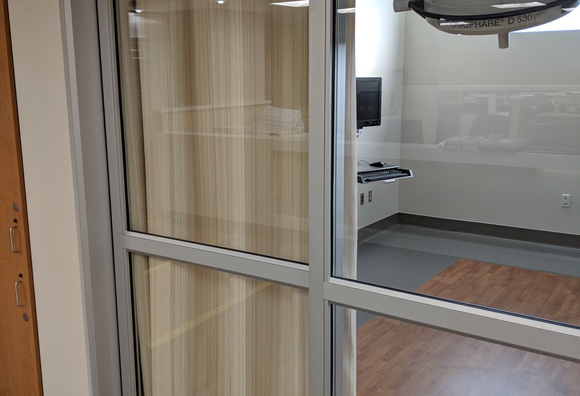
Where is `door jamb`? The width and height of the screenshot is (580, 396). door jamb is located at coordinates coord(59,14), coord(75,201), coord(88,367).